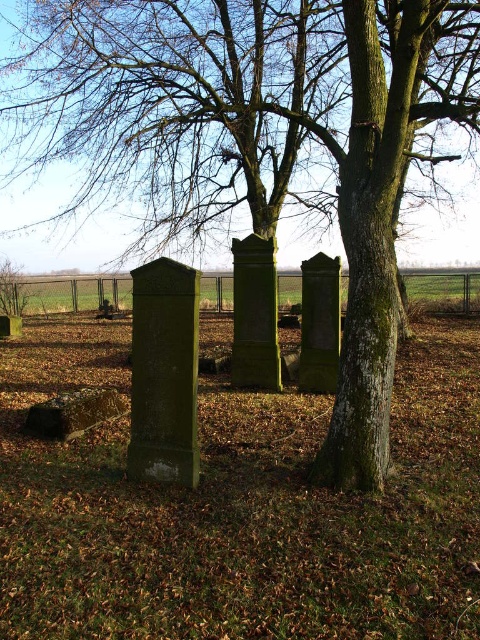
Question: Among these points, which one is nearest to the camera?

Choices:
 (A) (463, 291)
 (B) (58, 408)

Answer: (B)

Question: Does green grass at center appear under smooth stone gravestone at lower left?

Choices:
 (A) no
 (B) yes

Answer: (A)

Question: Which object is farther from the camera taking this photo?

Choices:
 (A) smooth stone gravestone at lower left
 (B) green grass at center

Answer: (B)

Question: Can you confirm if green grass at center is positioned to the left of smooth stone gravestone at lower left?

Choices:
 (A) yes
 (B) no

Answer: (B)

Question: Does green grass at center appear under smooth stone gravestone at lower left?

Choices:
 (A) yes
 (B) no

Answer: (B)